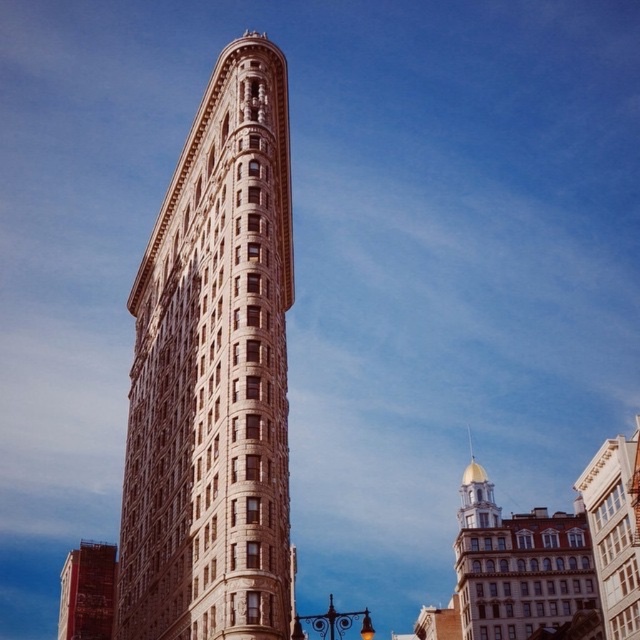
Looking at this image, is beige stone building at center to the right of red brick building at lower left from the viewer's perspective?

Yes, beige stone building at center is to the right of red brick building at lower left.

Does beige stone building at center have a lesser height compared to red brick building at lower left?

In fact, beige stone building at center may be taller than red brick building at lower left.

Does point (225, 362) come in front of point (106, 596)?

Yes.

This screenshot has height=640, width=640. Identify the location of beige stone building at center. (212, 374).